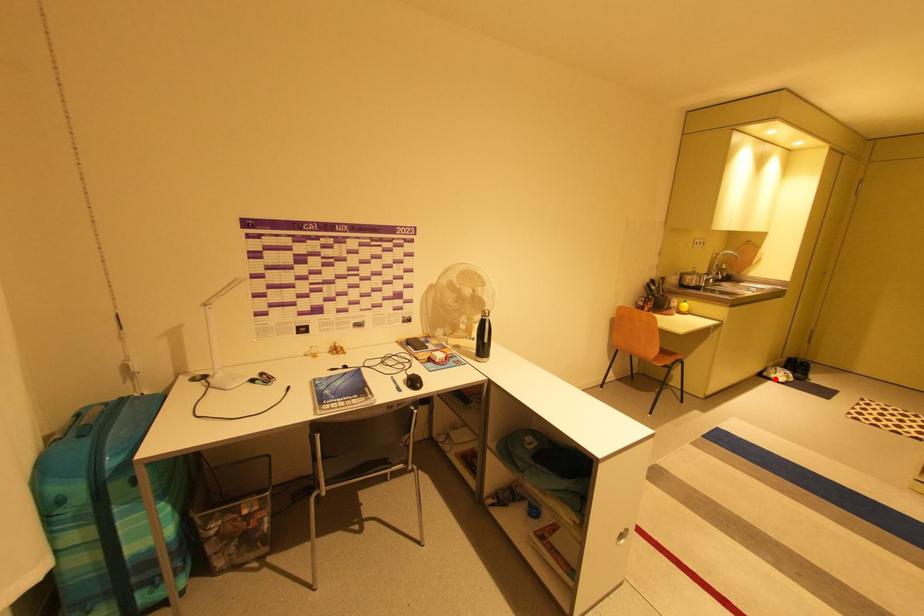
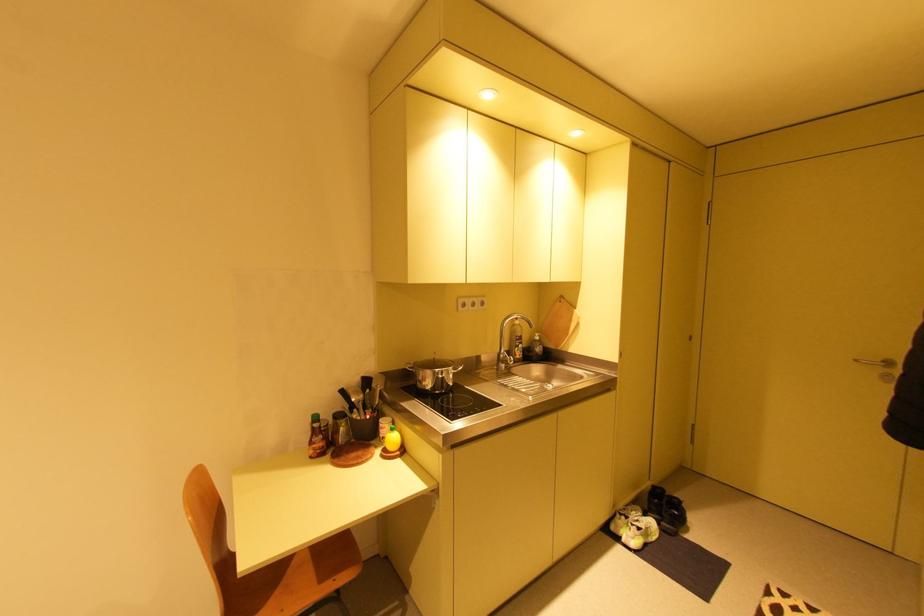
Find the pixel in the second image that matches the highlighted location in the first image.

(623, 538)